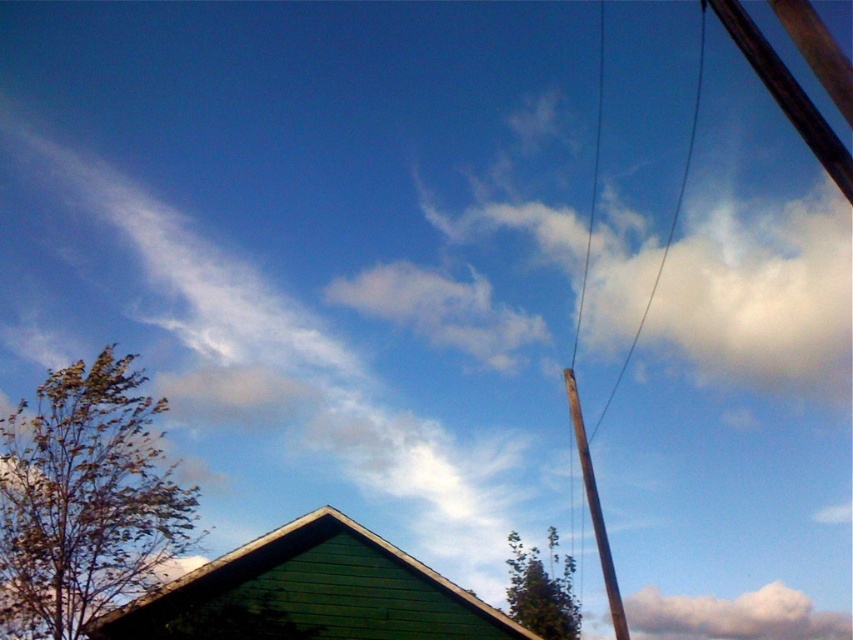
You are standing in the scene and want to place a small flag at both the point at (125, 362) and the point at (538, 627). Which point will have the flag that appears larger in your view?

The point at (125, 362) will have the flag that appears larger because it is closer to the camera than the point at (538, 627).

Consider the image. You are standing in the middle of the scene and want to determine which object is taller between the brown leafy tree at lower left and the brown wooden telegraph pole at right. Based on the scene, which one is taller?

The brown leafy tree at lower left has a lesser height compared to the brown wooden telegraph pole at right, so the brown wooden telegraph pole at right is taller.